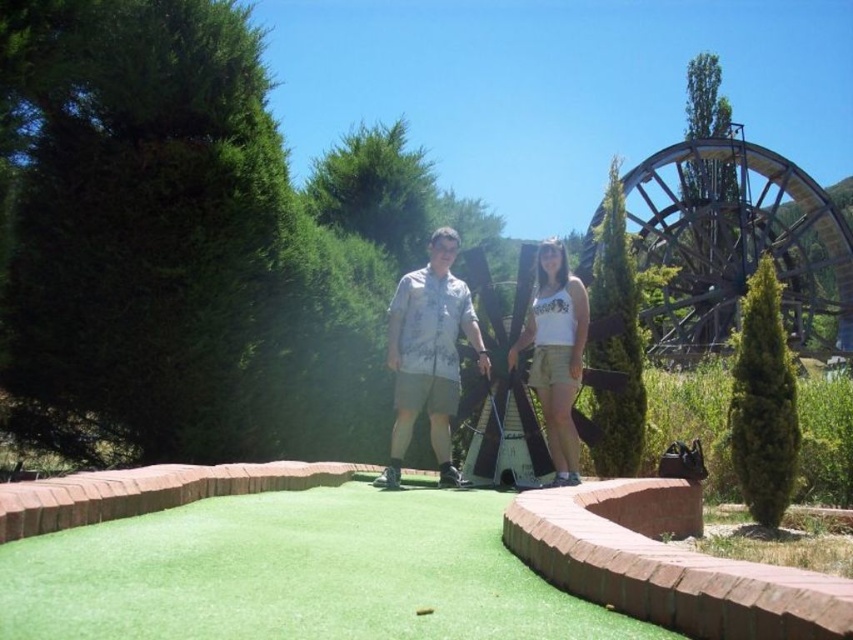
You are standing on the green and want to determine which of the two points, point (299, 573) or point (392, 307), is closer to you. Based on the image, which point is nearer?

Point (299, 573) is closer to the viewer than point (392, 307).

What is the exact 2D coordinate of the green artificial turf at center?

The green artificial turf at center is located at the 2D coordinate point of (294, 573).

You are a photographer positioned at the back of the mini golf course. You want to take a photo of the light gray shirt at center and white cotton tank top at center. Which one is closer to the left side of the frame?

The light gray shirt at center is closer to the left side of the frame because it is positioned to the left of the white cotton tank top at center.